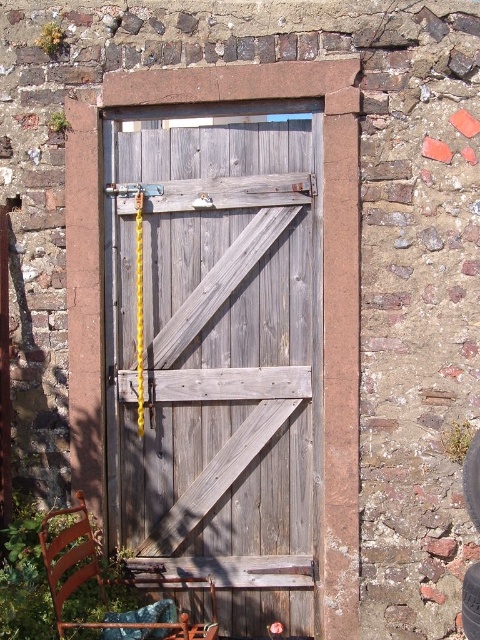
Who is shorter, black rubber tire at lower right or black rubber tire at center?

black rubber tire at center

What do you see at coordinates (471, 480) in the screenshot?
I see `black rubber tire at lower right` at bounding box center [471, 480].

The width and height of the screenshot is (480, 640). Find the location of `black rubber tire at lower right`. black rubber tire at lower right is located at coordinates (x=471, y=480).

Between wooden chair at lower left and black rubber tire at center, which one is positioned lower?

Positioned lower is black rubber tire at center.

Who is more distant from viewer, (48, 561) or (467, 593)?

Point (467, 593)

Between point (147, 570) and point (472, 628), which one is positioned in front?

Point (472, 628) is more forward.

At what (x,y) coordinates should I click in order to perform the action: click on wooden chair at lower left. Please return your answer as a coordinate pair (x, y). This screenshot has width=480, height=640. Looking at the image, I should click on (108, 579).

Does wooden chair at lower left have a smaller size compared to black rubber tire at lower right?

No, wooden chair at lower left is not smaller than black rubber tire at lower right.

What do you see at coordinates (108, 579) in the screenshot?
I see `wooden chair at lower left` at bounding box center [108, 579].

Find the location of a particular element. Image resolution: width=480 pixels, height=640 pixels. wooden chair at lower left is located at coordinates (108, 579).